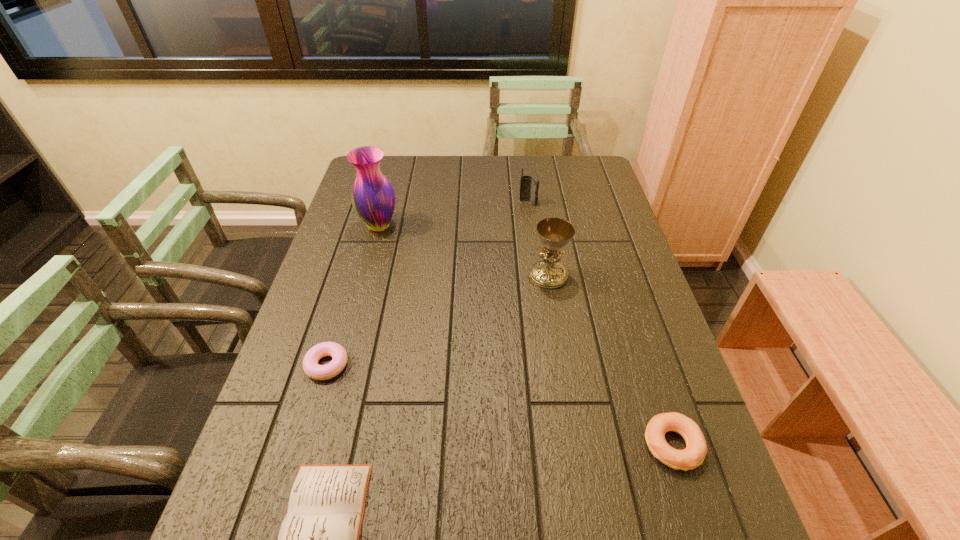
Identify the location of vacant point located 0.140m on the front of the vase. (368, 269).

Where is `free space located on the back of the second tallest object`? The width and height of the screenshot is (960, 540). free space located on the back of the second tallest object is located at coordinates (541, 235).

Identify the location of free space located on the keyboard of the fourth shortest object. The height and width of the screenshot is (540, 960). (540, 290).

Locate an element on the screen. This screenshot has height=540, width=960. vacant point located on the left of the third shortest object is located at coordinates (506, 446).

Identify the location of free space located 0.310m on the right of the fifth tallest object. Image resolution: width=960 pixels, height=540 pixels. 480,364.

The width and height of the screenshot is (960, 540). Identify the location of vase present at the left edge. (373, 198).

Where is `doughnut that is at the left edge`? doughnut that is at the left edge is located at coordinates (311, 367).

You are a GUI agent. You are given a task and a screenshot of the screen. Output one action in this format:
    pyautogui.click(x=<x>, y=<y>)
    Task: Click on the object located in the right edge section of the desktop
    
    Given the screenshot: What is the action you would take?
    click(693, 455)

The image size is (960, 540). Identify the location of free region at the far edge of the desktop. (438, 186).

Where is `vacant point at the left edge`? vacant point at the left edge is located at coordinates (379, 243).